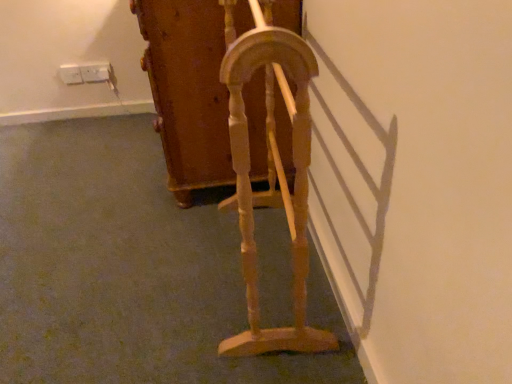
Question: Considering the relative sizes of white plastic electric outlet at upper left, arranged as the 2th electric outlet when viewed from the right, and wooden cabinet at center, the 2th furniture viewed from the front, in the image provided, is white plastic electric outlet at upper left, arranged as the 2th electric outlet when viewed from the right, smaller than wooden cabinet at center, the 2th furniture viewed from the front,?

Choices:
 (A) no
 (B) yes

Answer: (B)

Question: Can you confirm if white plastic electric outlet at upper left, arranged as the 2th electric outlet when viewed from the right, is positioned to the left of wooden cabinet at center, positioned as the first furniture in back-to-front order?

Choices:
 (A) yes
 (B) no

Answer: (A)

Question: Is white plastic electric outlet at upper left, arranged as the 2th electric outlet when viewed from the right, at the right side of wooden cabinet at center, positioned as the first furniture in back-to-front order?

Choices:
 (A) no
 (B) yes

Answer: (A)

Question: Does white plastic electric outlet at upper left, placed as the 1th electric outlet when sorted from left to right, contain wooden cabinet at center, positioned as the first furniture in back-to-front order?

Choices:
 (A) yes
 (B) no

Answer: (B)

Question: Is white plastic electric outlet at upper left, arranged as the 2th electric outlet when viewed from the right, positioned far away from wooden cabinet at center, positioned as the first furniture in back-to-front order?

Choices:
 (A) yes
 (B) no

Answer: (A)

Question: Considering their positions, is light wood/woodenobject at center, the 1th furniture when ordered from front to back, located in front of or behind white plastic electric outlet at upper left, placed as the 1th electric outlet when sorted from left to right?

Choices:
 (A) front
 (B) behind

Answer: (A)

Question: Is point (302, 67) closer or farther from the camera than point (81, 81)?

Choices:
 (A) farther
 (B) closer

Answer: (B)

Question: Is light wood/woodenobject at center, which is counted as the 2th furniture, starting from the back, wider or thinner than white plastic electric outlet at upper left, placed as the 1th electric outlet when sorted from left to right?

Choices:
 (A) thin
 (B) wide

Answer: (B)

Question: From the image's perspective, is light wood/woodenobject at center, which is counted as the 2th furniture, starting from the back, located above or below white plastic electric outlet at upper left, arranged as the 2th electric outlet when viewed from the right?

Choices:
 (A) above
 (B) below

Answer: (B)

Question: Is light wood/woodenobject at center, the 1th furniture when ordered from front to back, to the left or to the right of white plastic electric outlet at upper left, positioned as the first electric outlet in right-to-left order, in the image?

Choices:
 (A) right
 (B) left

Answer: (A)

Question: Is light wood/woodenobject at center, which is counted as the 2th furniture, starting from the back, inside or outside of white plastic electric outlet at upper left, positioned as the first electric outlet in right-to-left order?

Choices:
 (A) outside
 (B) inside

Answer: (A)

Question: From a real-world perspective, is light wood/woodenobject at center, which is counted as the 2th furniture, starting from the back, above or below white plastic electric outlet at upper left, positioned as the 2th electric outlet in left-to-right order?

Choices:
 (A) above
 (B) below

Answer: (A)

Question: Considering their positions, is light wood/woodenobject at center, which is counted as the 2th furniture, starting from the back, located in front of or behind white plastic electric outlet at upper left, positioned as the first electric outlet in right-to-left order?

Choices:
 (A) front
 (B) behind

Answer: (A)

Question: In the image, is white plastic electric outlet at upper left, placed as the 1th electric outlet when sorted from left to right, on the left side or the right side of light wood/woodenobject at center, the 1th furniture when ordered from front to back?

Choices:
 (A) right
 (B) left

Answer: (B)

Question: From the image's perspective, is white plastic electric outlet at upper left, placed as the 1th electric outlet when sorted from left to right, located above or below light wood/woodenobject at center, which is counted as the 2th furniture, starting from the back?

Choices:
 (A) below
 (B) above

Answer: (B)